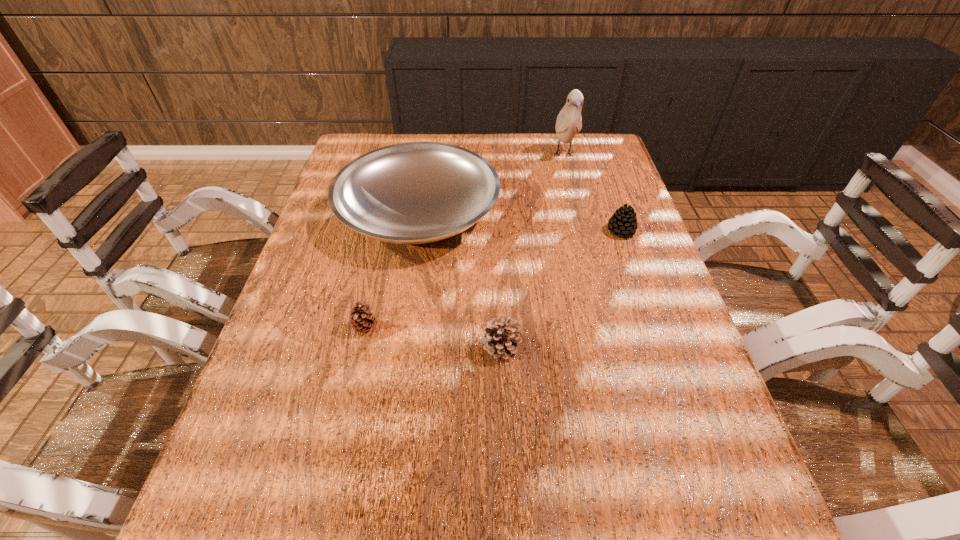
The width and height of the screenshot is (960, 540). I want to click on vacant space that's between the farthest pinecone and the tallest object, so click(x=592, y=193).

The image size is (960, 540). Identify the location of vacant space that's between the bird and the second pinecone from right to left. (533, 250).

Where is `vacant area that lies between the second pinecone from right to left and the bedpan`? The height and width of the screenshot is (540, 960). vacant area that lies between the second pinecone from right to left and the bedpan is located at coordinates (460, 279).

Image resolution: width=960 pixels, height=540 pixels. In order to click on unoccupied area between the farthest pinecone and the bedpan in this screenshot , I will do `click(519, 221)`.

Locate an element on the screen. free space that is in between the bedpan and the leftmost pinecone is located at coordinates (392, 269).

What are the coordinates of `vacant space that's between the leftmost pinecone and the bedpan` in the screenshot? It's located at (392, 269).

The width and height of the screenshot is (960, 540). Find the location of `free space between the leftmost pinecone and the tallest object`. free space between the leftmost pinecone and the tallest object is located at coordinates (465, 241).

Locate which object is the second closest to the bedpan. Please provide its 2D coordinates. Your answer should be formatted as a tuple, i.e. [(x, y)], where the tuple contains the x and y coordinates of a point satisfying the conditions above.

[(569, 121)]

In order to click on the second closest object to the bedpan in this screenshot , I will do coord(569,121).

Where is `pinecone that is the second closest to the farthest pinecone`? pinecone that is the second closest to the farthest pinecone is located at coordinates point(362,320).